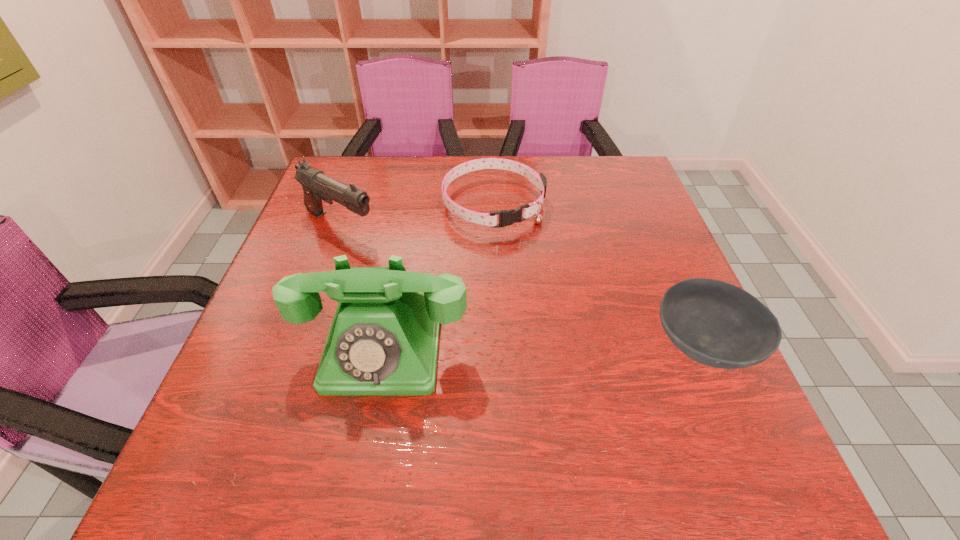
At what (x,y) coordinates should I click in order to perform the action: click on empty location between the shortest object and the second tallest object. Please return your answer as a coordinate pair (x, y). The height and width of the screenshot is (540, 960). Looking at the image, I should click on (417, 215).

Locate an element on the screen. The height and width of the screenshot is (540, 960). free space between the rightmost object and the tallest object is located at coordinates (543, 347).

Locate an element on the screen. The width and height of the screenshot is (960, 540). vacant space that is in between the dog collar and the rightmost object is located at coordinates (598, 275).

This screenshot has height=540, width=960. I want to click on unoccupied position between the second tallest object and the second shortest object, so click(521, 286).

Identify which object is the closest to the gun. Please provide its 2D coordinates. Your answer should be formatted as a tuple, i.e. [(x, y)], where the tuple contains the x and y coordinates of a point satisfying the conditions above.

[(506, 217)]

Image resolution: width=960 pixels, height=540 pixels. In order to click on object that stands as the third closest to the tallest object in this screenshot , I will do `click(717, 324)`.

The height and width of the screenshot is (540, 960). I want to click on vacant region that satisfies the following two spatial constraints: 1. on the front side of the rightmost object; 2. on the right side of the third shortest object, so click(297, 346).

Find the location of a particular element. This screenshot has width=960, height=540. free space in the image that satisfies the following two spatial constraints: 1. on the front side of the dog collar; 2. on the left side of the rightmost object is located at coordinates (499, 346).